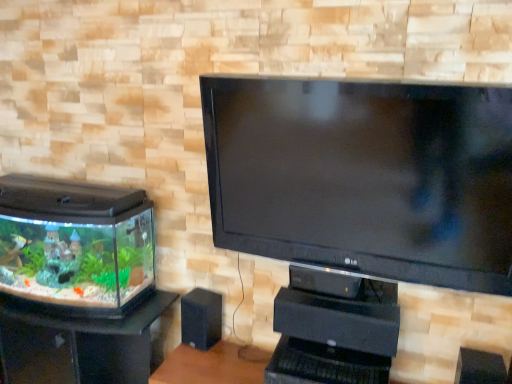
Identify the location of vacant area that is in front of black matte speaker at lower center. (198, 358).